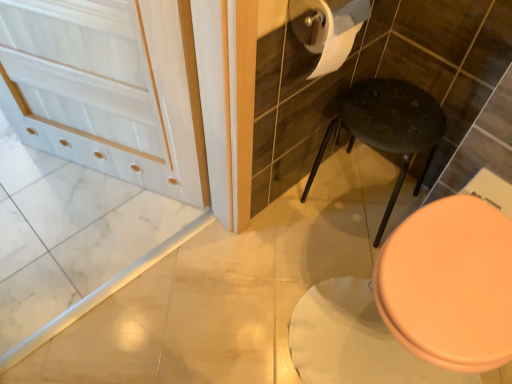
Locate an element on the screen. free region on the left part of dark speckled plastic stool at center is located at coordinates (281, 223).